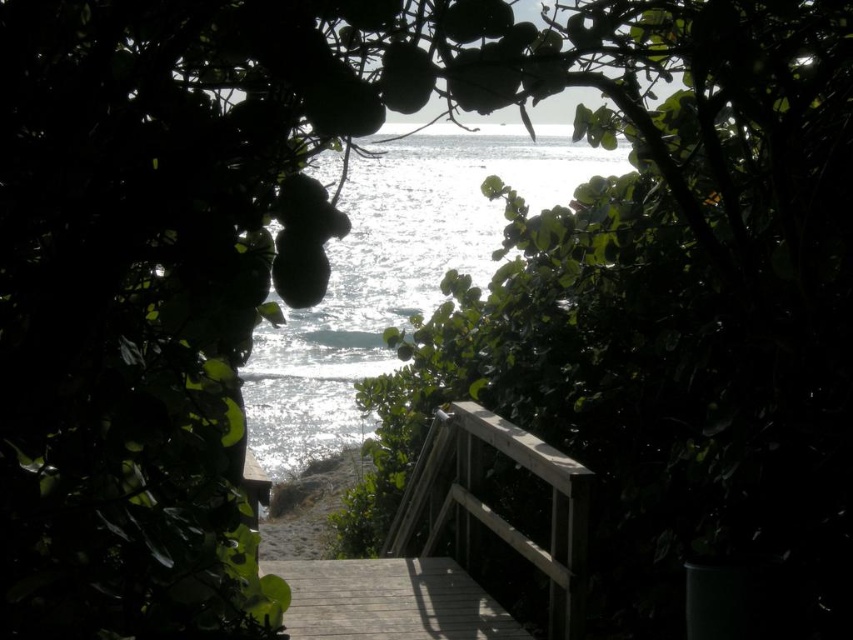
Can you confirm if wooden balustrade at center is positioned below wooden deck at center?

No.

Is wooden balustrade at center wider than wooden deck at center?

No.

Does point (561, 483) come in front of point (491, 621)?

Yes, it is.

At what (x,y) coordinates should I click in order to perform the action: click on wooden balustrade at center. Please return your answer as a coordinate pair (x, y). The width and height of the screenshot is (853, 640). Looking at the image, I should click on (492, 509).